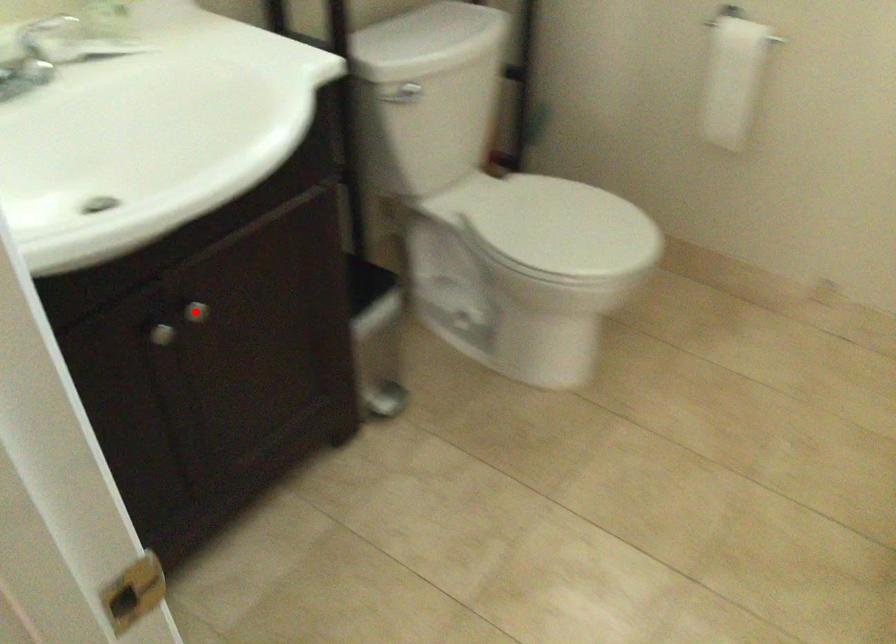
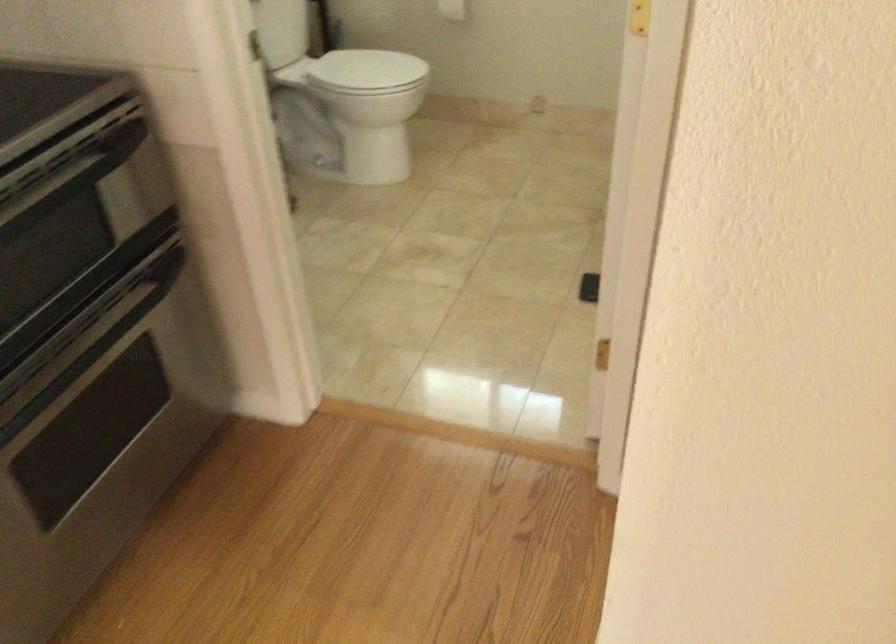
Question: I am providing you with two images of the same scene from different viewpoints. A red point is marked on the first image. At the location where the point appears in image 1, is it still visible in image 2?

Choices:
 (A) Yes
 (B) No

Answer: (B)